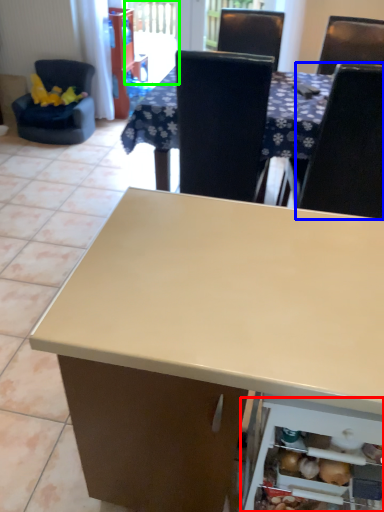
Question: Which object is positioned farthest from shelf (highlighted by a red box)? Select from chair (highlighted by a blue box) and screen door (highlighted by a green box).

Choices:
 (A) chair
 (B) screen door

Answer: (B)